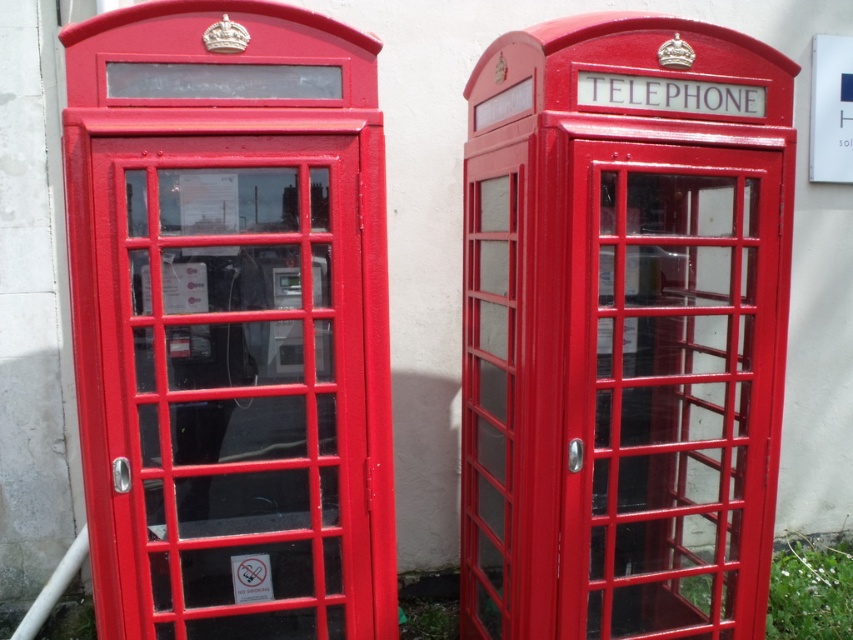
Is glossy red telephone booth at center positioned at the back of metallic red telephone box at left?

No, glossy red telephone booth at center is closer to the viewer.

Can you confirm if glossy red telephone booth at center is taller than metallic red telephone box at left?

Yes, glossy red telephone booth at center is taller than metallic red telephone box at left.

Consider the image. Measure the distance between glossy red telephone booth at center and camera.

2.18 meters

This screenshot has height=640, width=853. I want to click on glossy red telephone booth at center, so click(x=624, y=330).